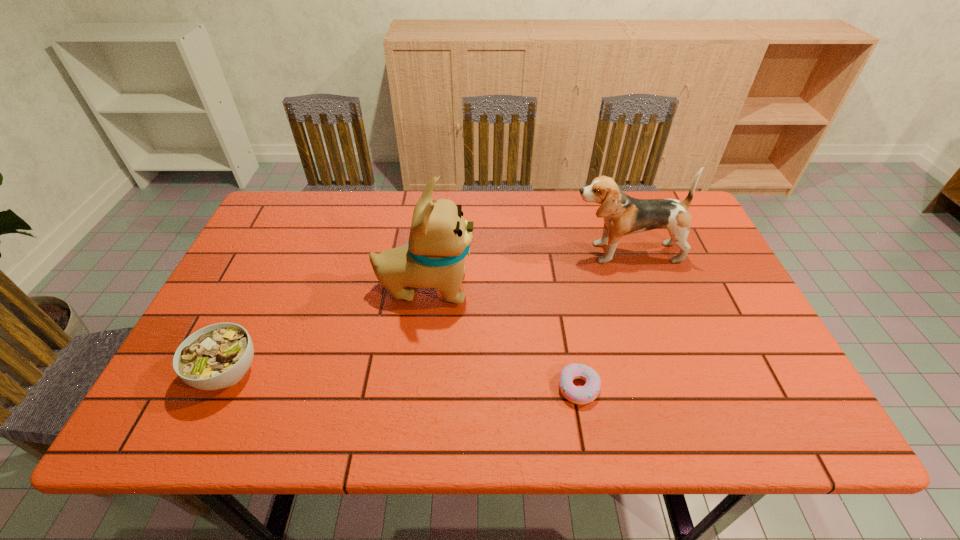
Image resolution: width=960 pixels, height=540 pixels. Find the location of `free spot located at the face of the farther puppy`. free spot located at the face of the farther puppy is located at coordinates (529, 253).

Where is `free point located on the right of the leftmost object`? This screenshot has height=540, width=960. free point located on the right of the leftmost object is located at coordinates (301, 372).

Identify the location of free space located on the left of the doughnut. The image size is (960, 540). (398, 388).

This screenshot has width=960, height=540. I want to click on soup bowl that is at the near edge, so click(217, 356).

The height and width of the screenshot is (540, 960). Find the location of `doughnut that is at the near edge`. doughnut that is at the near edge is located at coordinates (585, 394).

The image size is (960, 540). What are the coordinates of `object positioned at the left edge` in the screenshot? It's located at (217, 356).

Where is `object situated at the right edge`? object situated at the right edge is located at coordinates (623, 215).

In order to click on object positioned at the near left corner in this screenshot , I will do `click(217, 356)`.

In the image, there is a desktop. At what (x,y) coordinates should I click in order to perform the action: click on free space at the far edge. Please return your answer as a coordinate pair (x, y). This screenshot has height=540, width=960. Looking at the image, I should click on (556, 238).

Find the location of a particular element. vacant space at the near edge of the desktop is located at coordinates (314, 416).